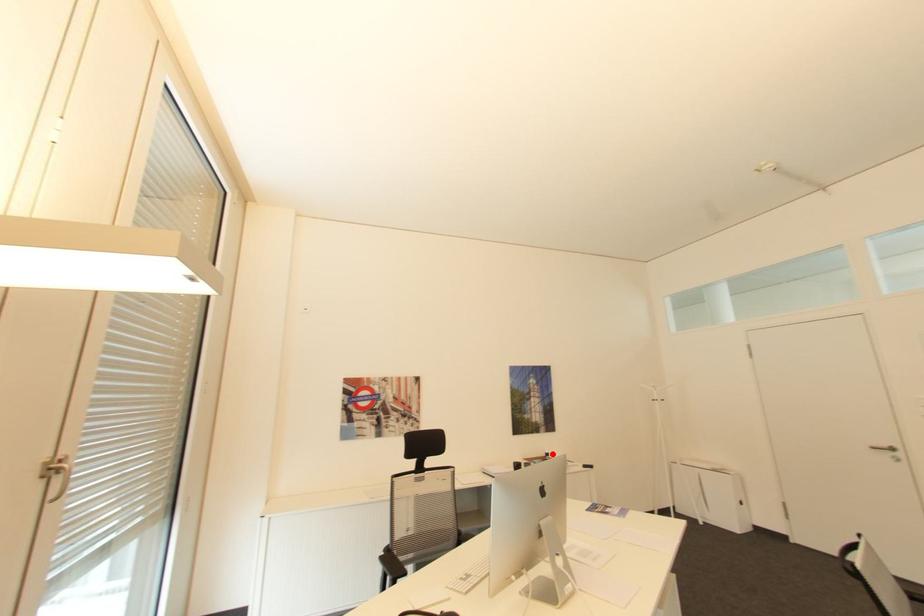
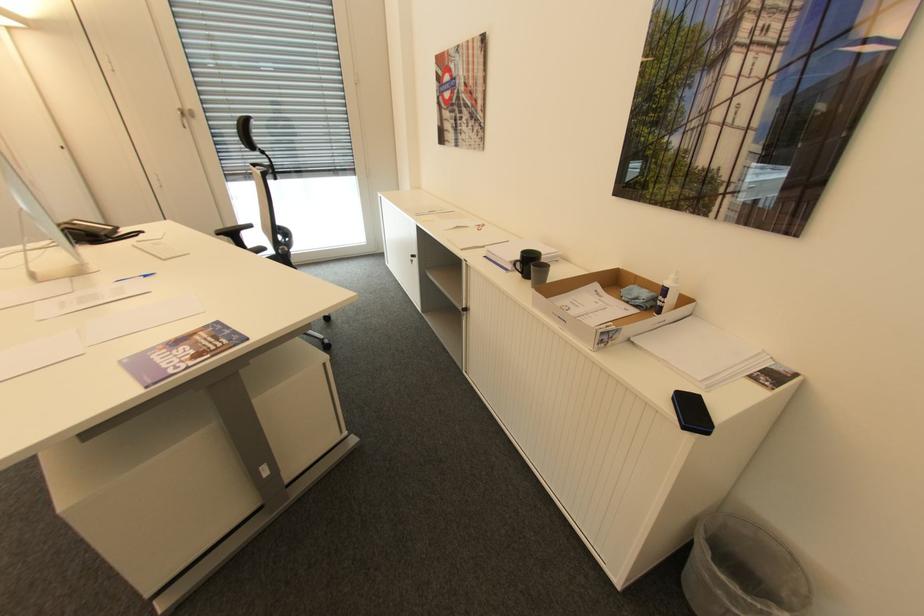
Where in the second image is the point corresponding to the highlighted location from the first image?

(670, 291)